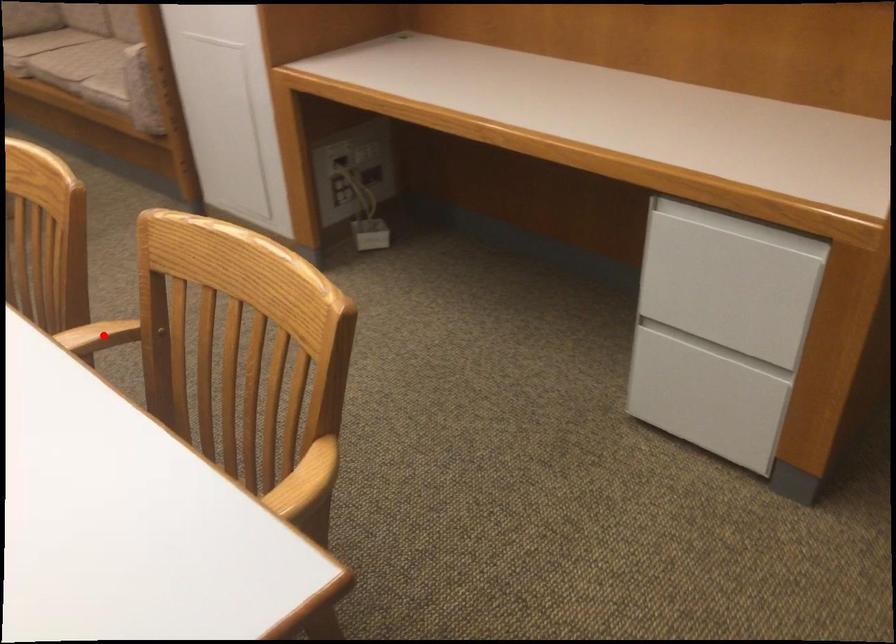
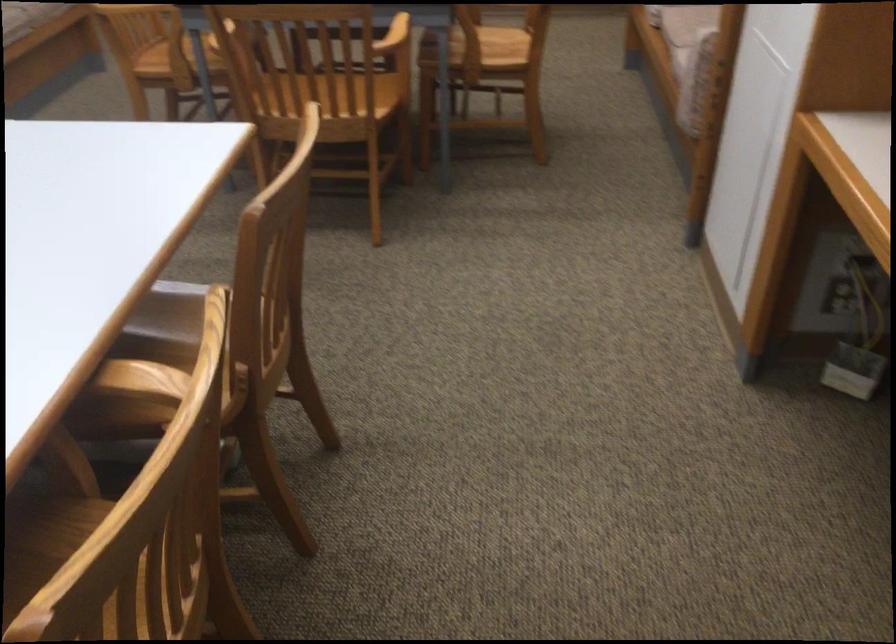
Question: I am providing you with two images of the same scene from different viewpoints. A red point is marked on the first image. At the location where the point appears in image 1, is it still visible in image 2?

Choices:
 (A) Yes
 (B) No

Answer: (B)